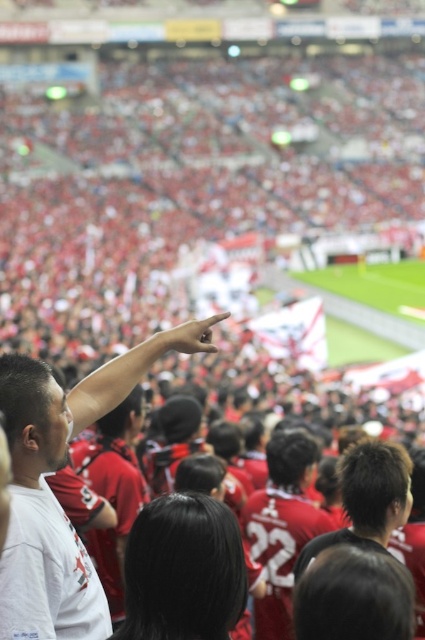
Question: Can you confirm if red jersey at left is positioned to the right of dark brown hair at center?

Choices:
 (A) no
 (B) yes

Answer: (A)

Question: From the image, what is the correct spatial relationship of white matte shirt at upper left in relation to dark brown hair at center?

Choices:
 (A) left
 (B) right

Answer: (A)

Question: Among these points, which one is nearest to the camera?

Choices:
 (A) (274, 456)
 (B) (78, 634)
 (C) (368, 476)

Answer: (B)

Question: Based on their relative distances, which object is nearer to the red jersey at left?

Choices:
 (A) dark brown hair at center
 (B) white matte shirt at upper left

Answer: (B)

Question: Does white matte shirt at upper left have a larger size compared to dark brown hair at center?

Choices:
 (A) yes
 (B) no

Answer: (A)

Question: Which object is positioned farthest from the white matte shirt at upper left?

Choices:
 (A) dark brown hair at center
 (B) red jersey at left

Answer: (A)